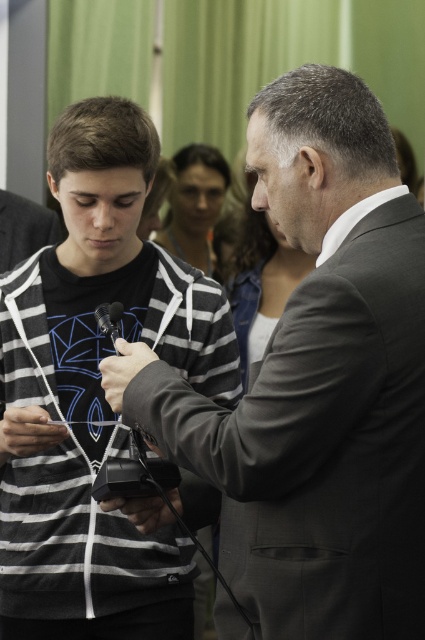
Does gray suit at center have a lesser width compared to silver metallic microphone at center?

Incorrect, gray suit at center's width is not less than silver metallic microphone at center's.

Is gray suit at center above silver metallic microphone at center?

No.

Who is more distant from viewer, (260, 529) or (99, 321)?

The point (99, 321) is more distant.

The image size is (425, 640). Identify the location of gray suit at center. (317, 381).

Can you confirm if black striped hoodie at left is positioned to the left of silver metallic microphone at center?

Indeed, black striped hoodie at left is positioned on the left side of silver metallic microphone at center.

Who is positioned more to the right, black striped hoodie at left or silver metallic microphone at center?

silver metallic microphone at center is more to the right.

Which is behind, point (136, 284) or point (102, 332)?

Point (136, 284)

Identify the location of black striped hoodie at left. Image resolution: width=425 pixels, height=640 pixels. (95, 392).

Between gray suit at center and black striped hoodie at left, which one has more height?

With more height is black striped hoodie at left.

Between gray suit at center and black striped hoodie at left, which one has less height?

gray suit at center

Who is more forward, (274, 369) or (187, 376)?

Point (274, 369)

Locate an element on the screen. The width and height of the screenshot is (425, 640). gray suit at center is located at coordinates (317, 381).